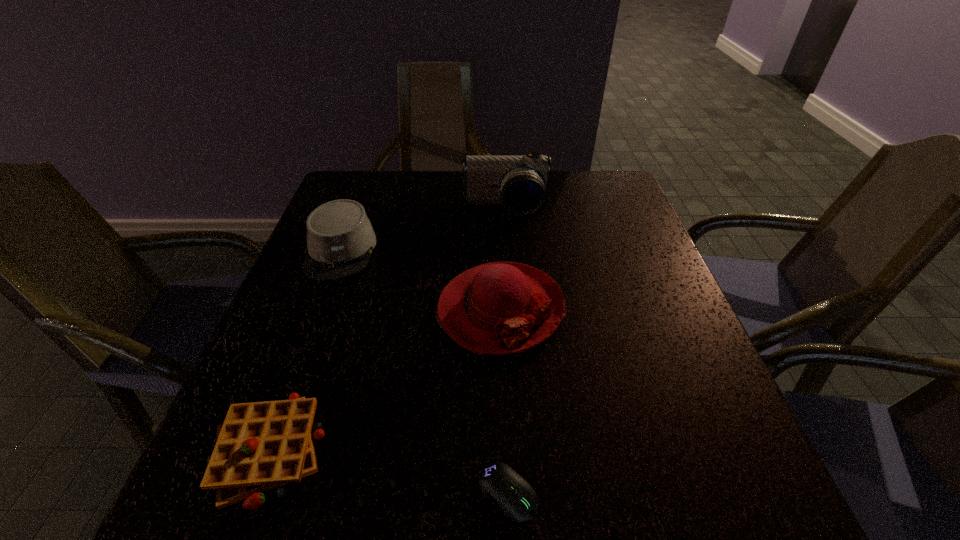
This screenshot has width=960, height=540. In order to click on vacant space located on the front-facing side of the third tallest object in this screenshot , I will do `click(285, 400)`.

The width and height of the screenshot is (960, 540). In order to click on vacant space located 0.180m on the back of the fourth tallest object in this screenshot , I will do `click(316, 320)`.

Image resolution: width=960 pixels, height=540 pixels. I want to click on free space located on the back of the computer equipment, so click(505, 418).

Find the location of `object that is at the far edge`. object that is at the far edge is located at coordinates (521, 183).

Identify the location of waffle that is positioned at the near edge. Image resolution: width=960 pixels, height=540 pixels. (260, 446).

This screenshot has height=540, width=960. I want to click on computer equipment at the near edge, so [499, 482].

Locate an element on the screen. The image size is (960, 540). hat positioned at the left edge is located at coordinates (340, 238).

The image size is (960, 540). What are the coordinates of `waffle that is at the left edge` in the screenshot? It's located at (260, 446).

Find the location of a particular element. object present at the near left corner is located at coordinates (260, 446).

The height and width of the screenshot is (540, 960). Find the location of `vacant space at the far edge of the desktop`. vacant space at the far edge of the desktop is located at coordinates (419, 214).